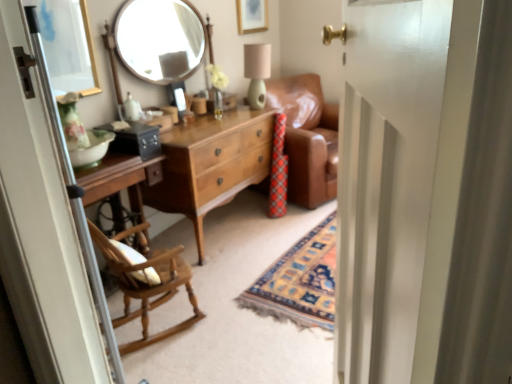
What are the coordinates of `vacant area situated below wooden rocking chair at left (from a real-world perspective)` in the screenshot? It's located at (157, 326).